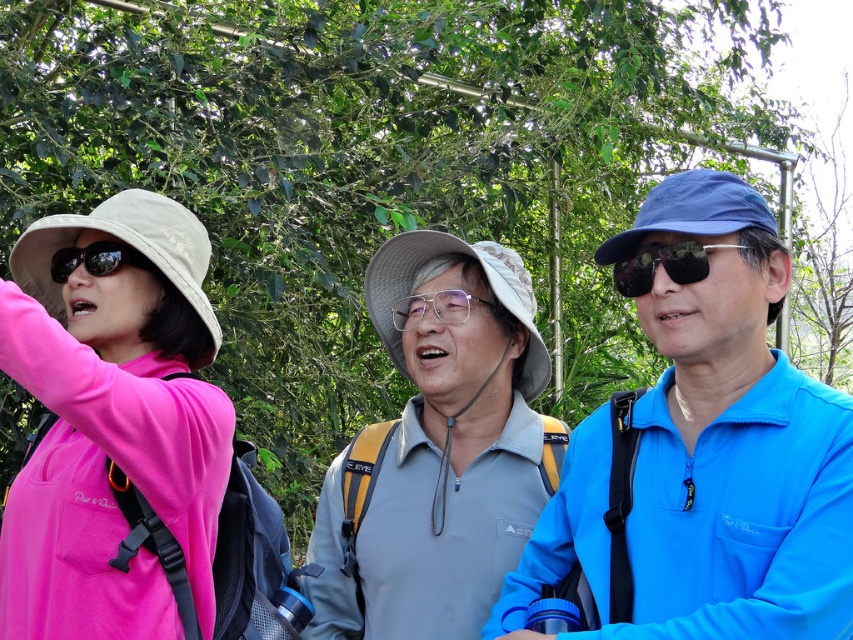
Question: Does blue matte jacket at right have a lesser width compared to pink matte jacket at left?

Choices:
 (A) yes
 (B) no

Answer: (B)

Question: Does blue matte jacket at right have a larger size compared to sunglasses at center?

Choices:
 (A) yes
 (B) no

Answer: (A)

Question: Is blue matte jacket at right to the right of matte black sunglasses at left from the viewer's perspective?

Choices:
 (A) no
 (B) yes

Answer: (B)

Question: Among these points, which one is farthest from the camera?

Choices:
 (A) (607, 484)
 (B) (80, 260)
 (C) (32, 330)

Answer: (B)

Question: Based on their relative distances, which object is nearer to the matte black sunglasses at left?

Choices:
 (A) pink matte jacket at left
 (B) sunglasses at center
 (C) blue matte jacket at right

Answer: (A)

Question: Which of the following is the farthest from the observer?

Choices:
 (A) (117, 596)
 (B) (132, 259)
 (C) (672, 550)

Answer: (B)